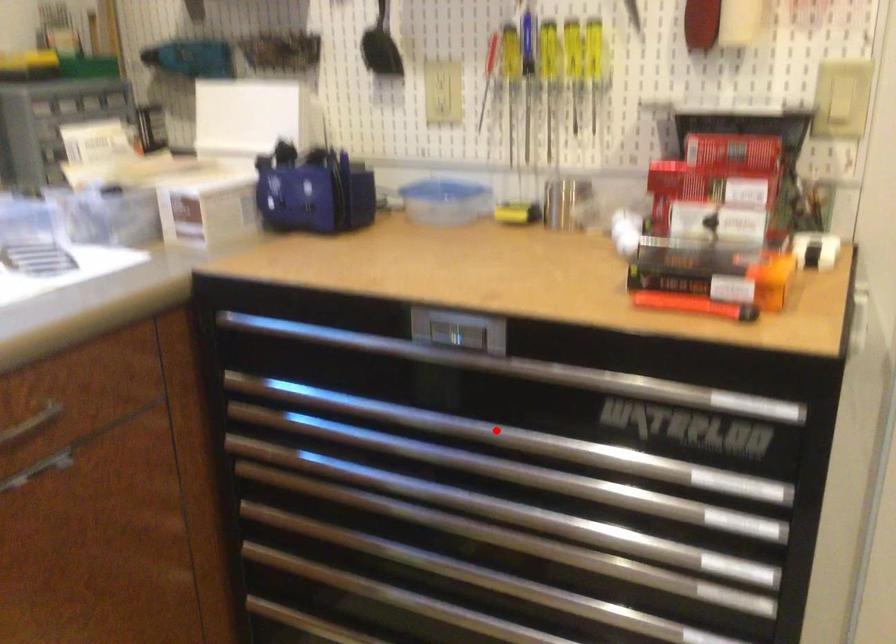
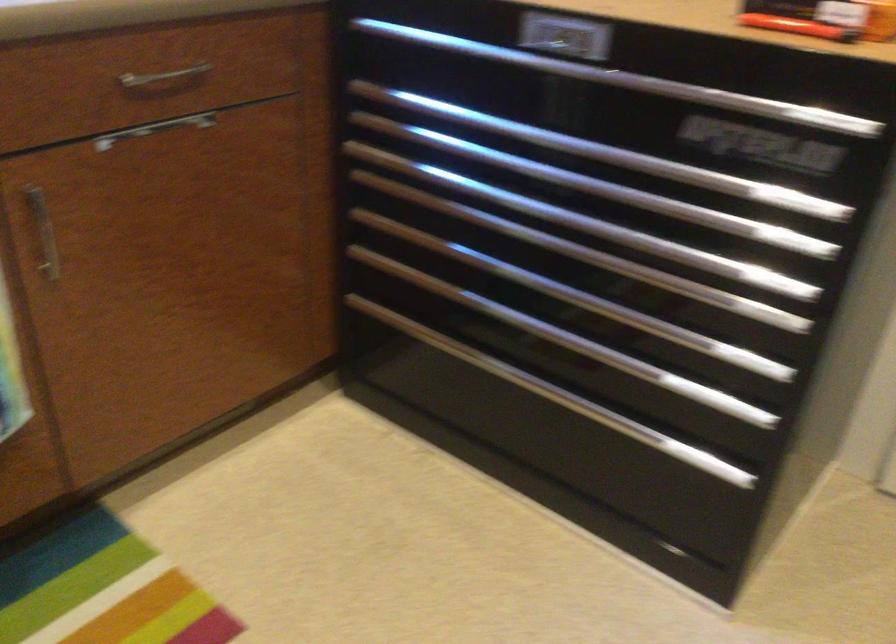
The point at the highlighted location is marked in the first image. Where is the corresponding point in the second image?

(580, 144)